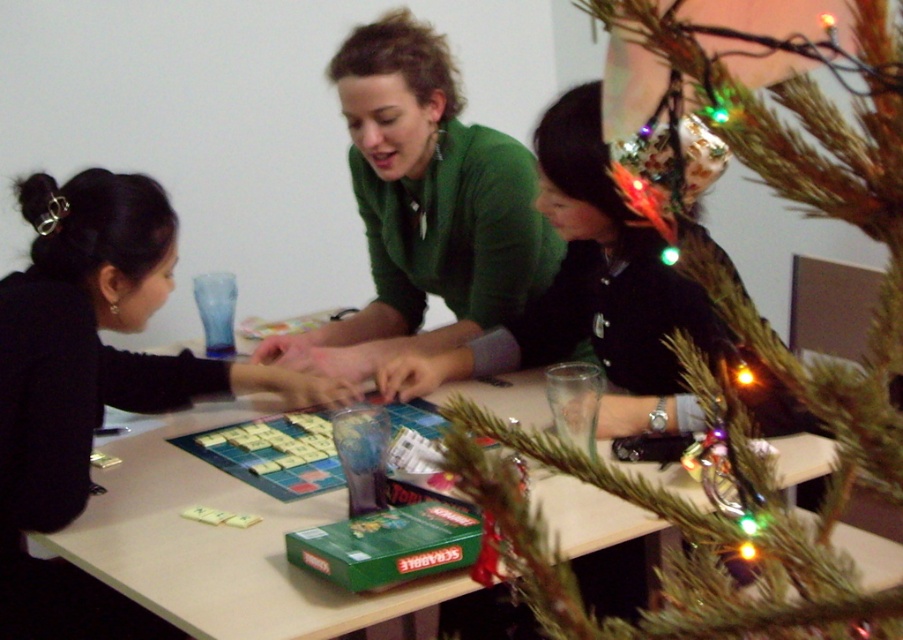
Question: Among these points, which one is farthest from the camera?

Choices:
 (A) (576, 490)
 (B) (507, 189)
 (C) (824, 193)
 (D) (132, 224)

Answer: (B)

Question: Is green artificial tree at center above black matte shirt at center?

Choices:
 (A) no
 (B) yes

Answer: (A)

Question: Can you confirm if black matte shirt at center is positioned to the left of green matte sweater at center?

Choices:
 (A) no
 (B) yes

Answer: (B)

Question: Considering the real-world distances, which object is farthest from the green matte sweater at center?

Choices:
 (A) black matte shirt at center
 (B) matte plastic board game at center

Answer: (B)

Question: Which of the following is the farthest from the observer?

Choices:
 (A) green artificial tree at center
 (B) matte plastic board game at center
 (C) green matte sweater at center

Answer: (C)

Question: Does green artificial tree at center appear on the left side of black matte shirt at center?

Choices:
 (A) yes
 (B) no

Answer: (B)